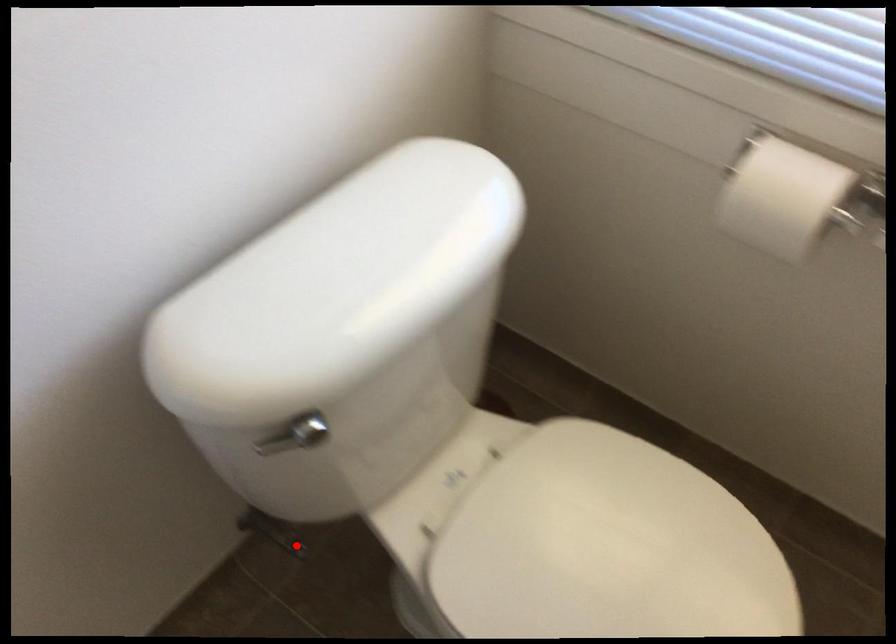
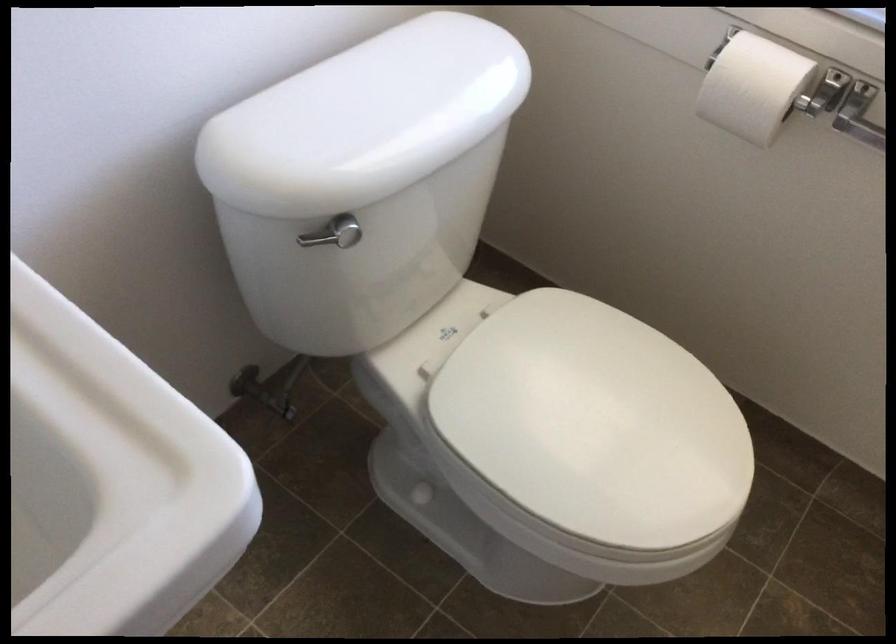
Where in the second image is the point corresponding to the highlighted location from the first image?

(285, 408)